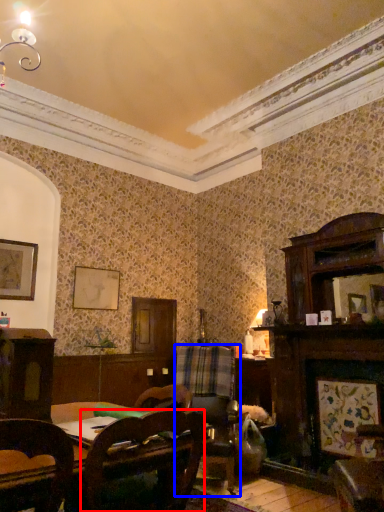
Question: Among these objects, which one is farthest to the camera, chair (highlighted by a red box) or swivel chair (highlighted by a blue box)?

Choices:
 (A) chair
 (B) swivel chair

Answer: (B)